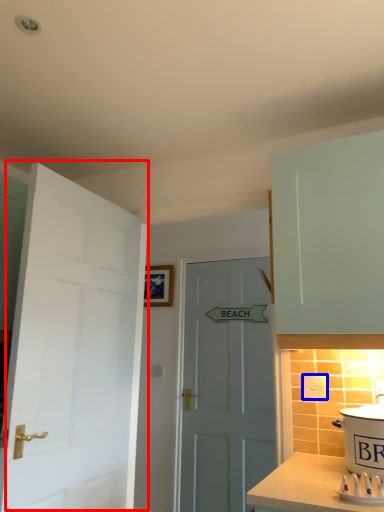
Question: Which point is closer to the camera, door (highlighted by a red box) or electric outlet (highlighted by a blue box)?

Choices:
 (A) door
 (B) electric outlet

Answer: (A)